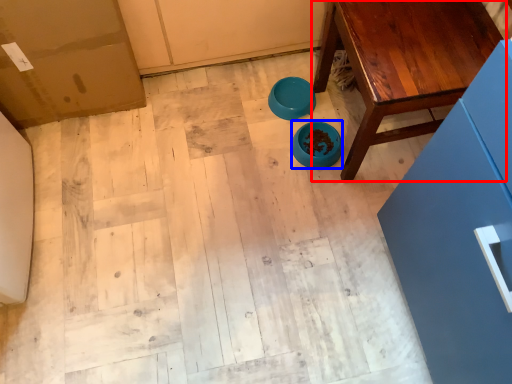
Question: Among these objects, which one is nearest to the camera, table (highlighted by a red box) or bowl (highlighted by a blue box)?

Choices:
 (A) table
 (B) bowl

Answer: (A)